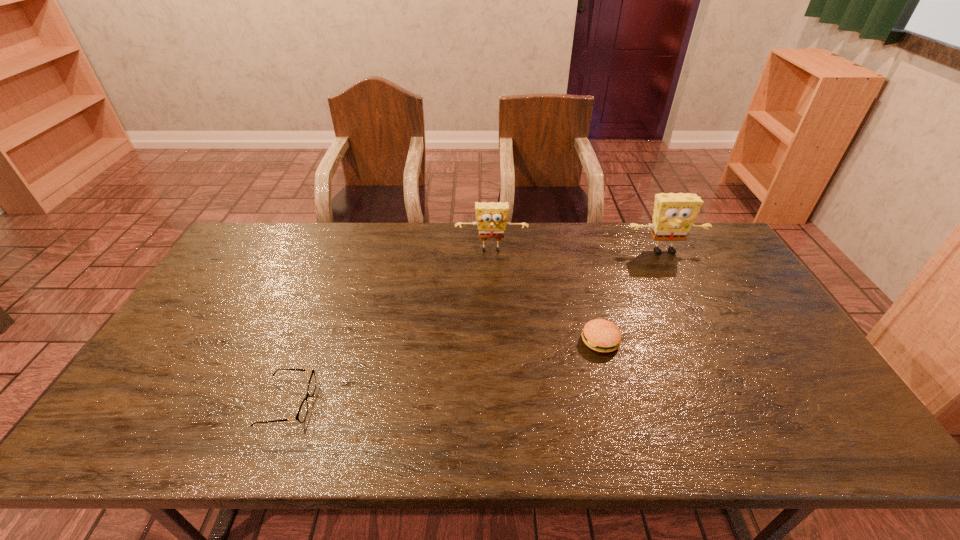
I want to click on vacant space situated on the right of the second object from right to left, so click(704, 341).

Find the location of a particular element. free space located 0.180m on the front-facing side of the spectacles is located at coordinates (386, 403).

The height and width of the screenshot is (540, 960). I want to click on object that is positioned at the near edge, so click(302, 412).

Image resolution: width=960 pixels, height=540 pixels. Find the location of `object that is at the right edge`. object that is at the right edge is located at coordinates pyautogui.click(x=674, y=214).

Where is `object present at the far right corner`? This screenshot has height=540, width=960. object present at the far right corner is located at coordinates (x=674, y=214).

Identify the location of free space at the far edge of the desktop. (351, 242).

Where is `free region at the near edge of the desktop`? The height and width of the screenshot is (540, 960). free region at the near edge of the desktop is located at coordinates (754, 429).

Locate an element on the screen. This screenshot has width=960, height=540. free region at the left edge of the desktop is located at coordinates (246, 295).

The height and width of the screenshot is (540, 960). Identify the location of free region at the right edge of the desktop. (710, 299).

Locate an element on the screen. vacant region at the near right corner of the desktop is located at coordinates (836, 419).